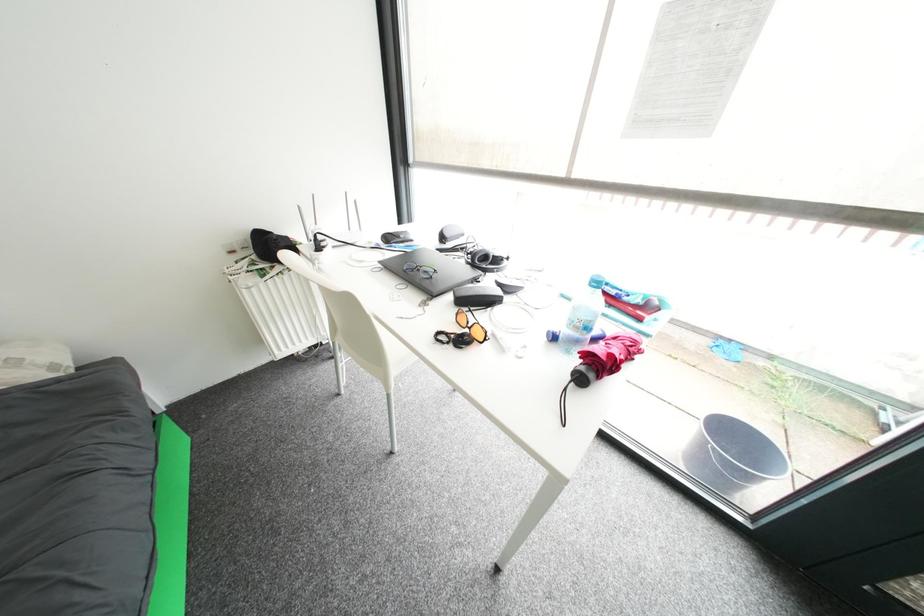
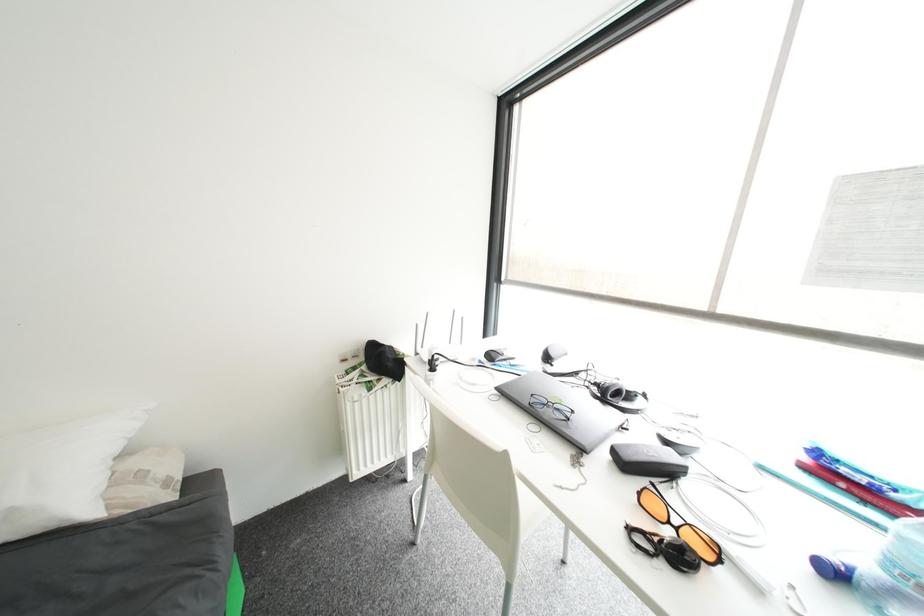
Question: The images are taken continuously from a first-person perspective. In which direction are you moving?

Choices:
 (A) Left
 (B) Right
 (C) Forward
 (D) Backward

Answer: (A)